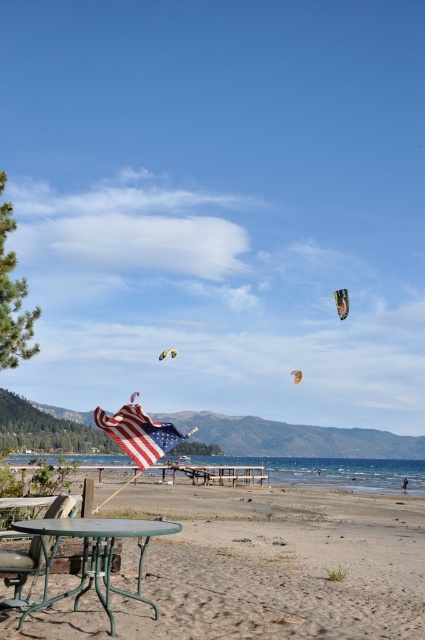
You are standing at the beach and want to walk from point (127, 452) to point (19, 600). Which direction should you move to get closer to the water?

You should move towards point (19, 600) because it is closer to the water than point (127, 452).